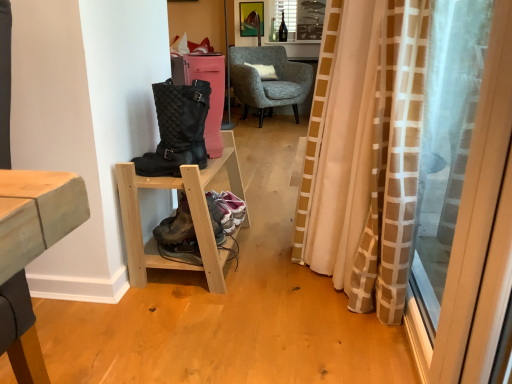
Question: Looking at their shapes, would you say leather/mesh hiking boots at lower center is wider or thinner than textured gray armchair at center?

Choices:
 (A) wide
 (B) thin

Answer: (B)

Question: Considering the relative positions of leather/mesh hiking boots at lower center and textured gray armchair at center in the image provided, is leather/mesh hiking boots at lower center to the left or to the right of textured gray armchair at center?

Choices:
 (A) left
 (B) right

Answer: (A)

Question: Based on their relative distances, which object is farther from the metallic gold picture frame at upper center?

Choices:
 (A) textured gray armchair at center
 (B) black quilted boots at left
 (C) white soft cushion at center
 (D) leather/mesh hiking boots at lower center
 (E) beige/white checkered curtain at right

Answer: (E)

Question: Estimate the real-world distances between objects in this image. Which object is closer to the textured gray armchair at center?

Choices:
 (A) white soft cushion at center
 (B) light wood/unfinished wood shelf at lower left
 (C) transparent plastic screen door at right
 (D) metallic gold picture frame at upper center
 (E) beige/white checkered curtain at right

Answer: (A)